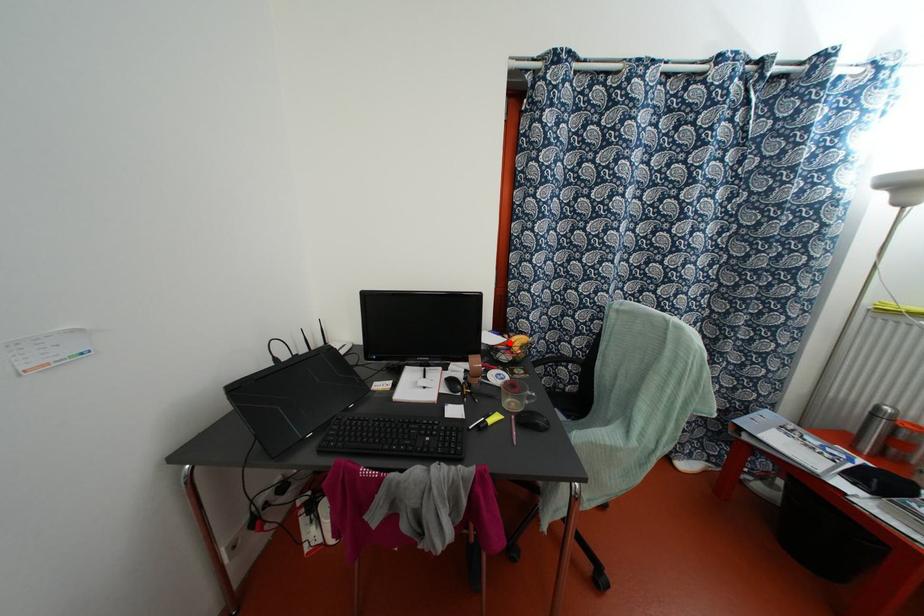
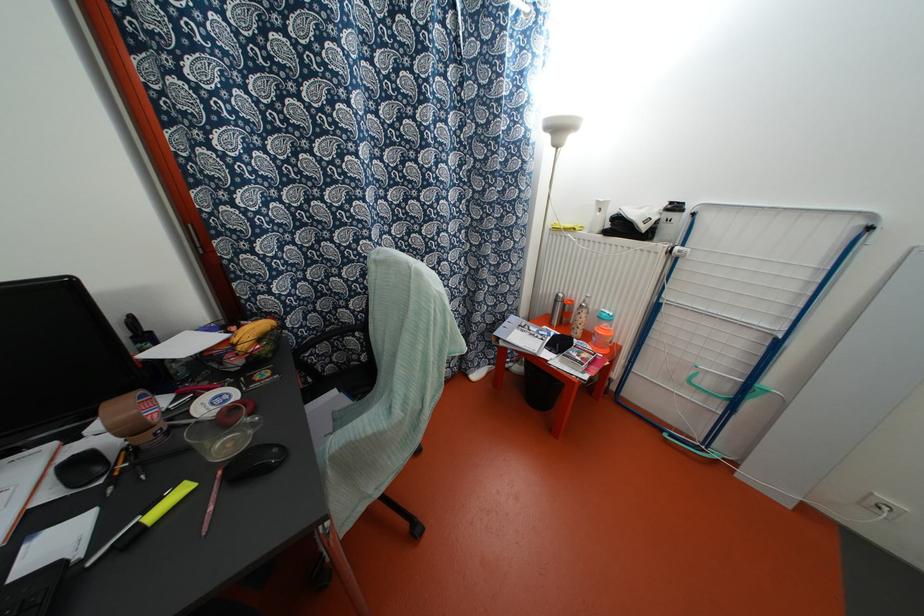
The point at the highlighted location is marked in the first image. Where is the corresponding point in the second image?

(234, 339)